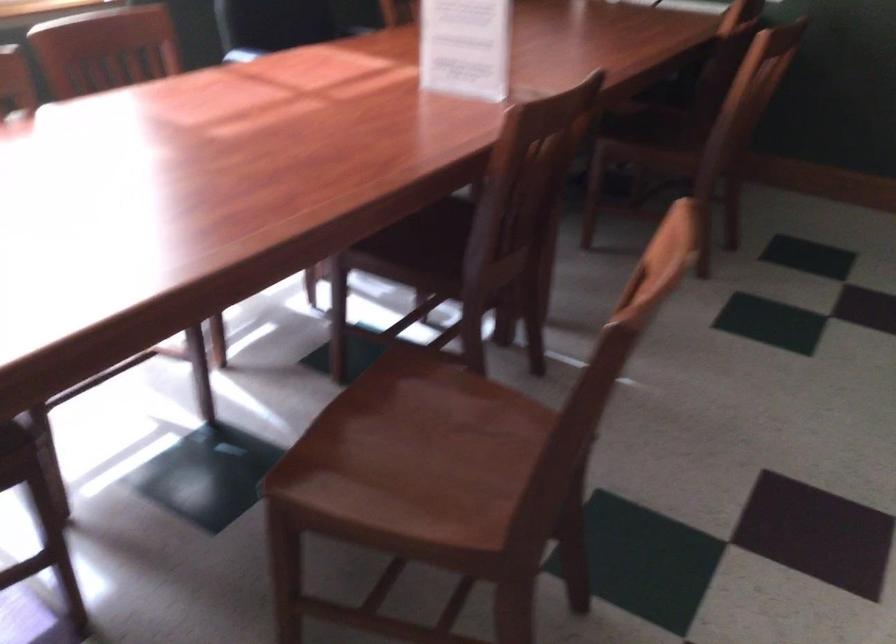
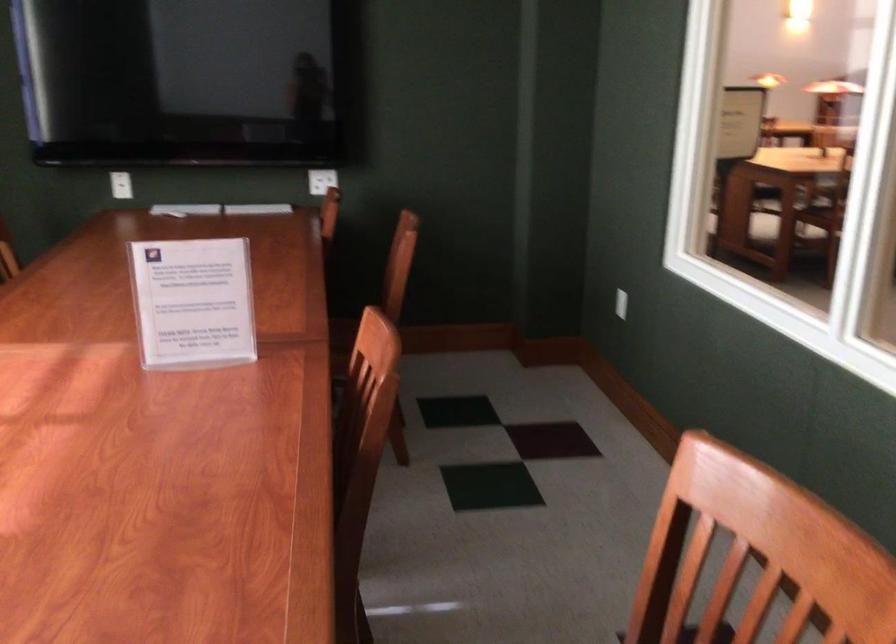
Question: I am providing you with two images of the same scene from different viewpoints. After the viewpoint changes to image2, which objects are now occluded?

Choices:
 (A) copper table lamp
 (B) white light switch
 (C) chair sitting surface
 (D) acrylic sign holder

Answer: (C)